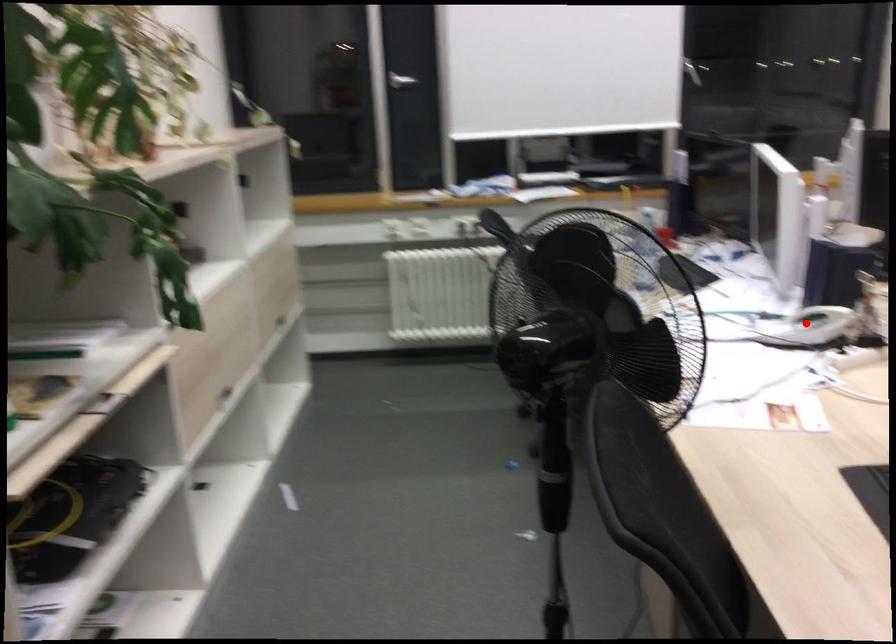
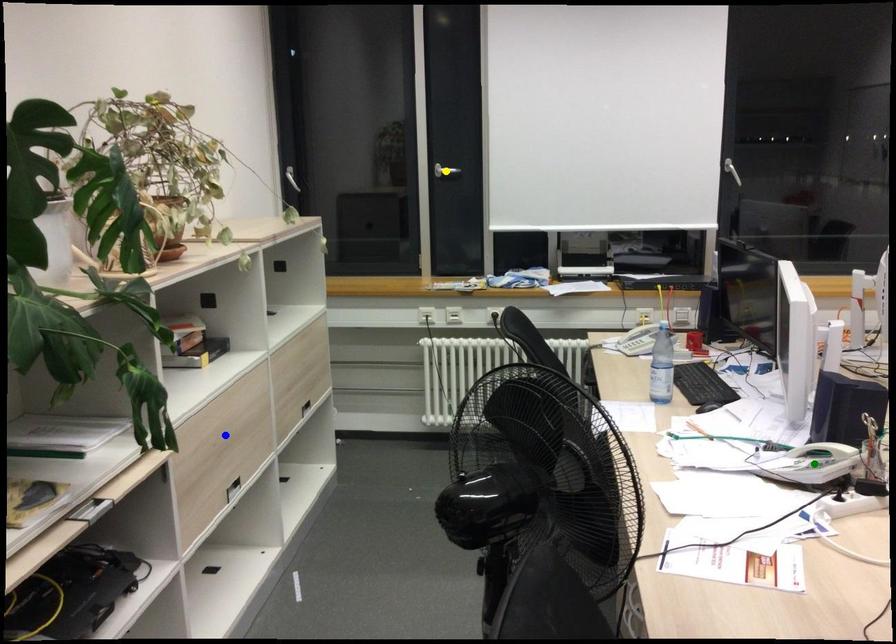
Question: I am providing you with two images of the same scene from different viewpoints. A red point is marked on the first image. You are given multiple points on the second image. Which point in image 2 represents the same 3d spot as the red point in image 1?

Choices:
 (A) yellow point
 (B) green point
 (C) blue point

Answer: (B)